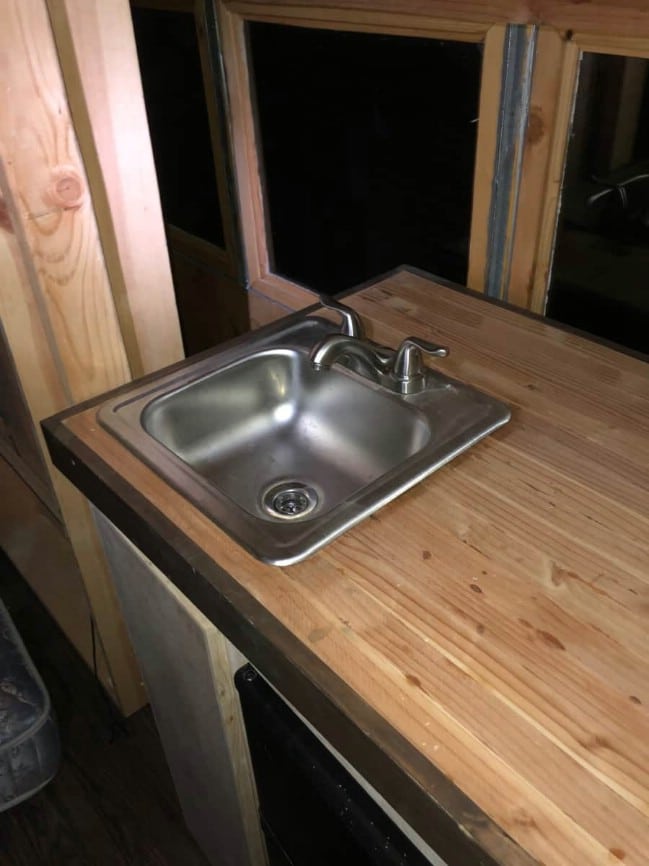
The height and width of the screenshot is (866, 649). Identify the location of floor. tap(93, 808).